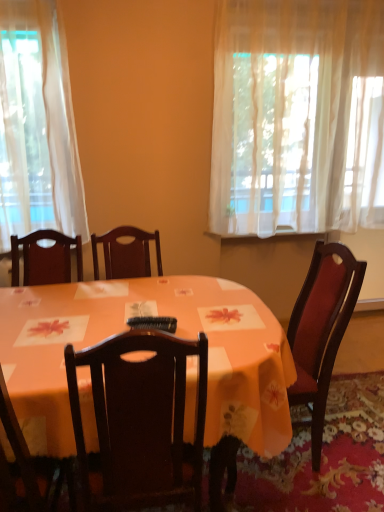
You are a GUI agent. You are given a task and a screenshot of the screen. Output one action in this format:
    pyautogui.click(x=<x>, y=<y>)
    Task: Click on the wooden chair at lower left
    Image resolution: width=384 pixels, height=512 pixels.
    Given the screenshot: What is the action you would take?
    pyautogui.click(x=19, y=449)

Image resolution: width=384 pixels, height=512 pixels. What do you see at coordinates (297, 117) in the screenshot?
I see `sheer white curtain at upper right` at bounding box center [297, 117].

This screenshot has height=512, width=384. I want to click on black plastic remote control at center, so click(153, 323).

The image size is (384, 512). I want to click on orange fabric table at center, so click(127, 329).

Which object is closer to the camera, orange fabric table at center or sheer white curtain at upper right?

orange fabric table at center.

Considering the sizes of objects orange fabric table at center and sheer white curtain at upper right in the image provided, who is taller, orange fabric table at center or sheer white curtain at upper right?

sheer white curtain at upper right.

From the image's perspective, between orange fabric table at center and sheer white curtain at upper right, which one is located above?

sheer white curtain at upper right appears higher in the image.

In the scene shown: Is orange fabric table at center located outside sheer white curtain at upper right?

orange fabric table at center lies outside sheer white curtain at upper right's area.

From the image's perspective, is sheer white curtain at upper right positioned above or below wooden chair at lower left?

Clearly, from the image's perspective, sheer white curtain at upper right is above wooden chair at lower left.

Is sheer white curtain at upper right to the left or to the right of wooden chair at lower left in the image?

sheer white curtain at upper right is to the right of wooden chair at lower left.

Considering the sizes of objects sheer white curtain at upper right and wooden chair at lower left in the image provided, who is taller, sheer white curtain at upper right or wooden chair at lower left?

sheer white curtain at upper right is taller.

Which point is more distant from viewer, (255, 8) or (7, 470)?

Positioned behind is point (255, 8).

Looking at this image, would you say wooden chair at lower left is to the left or to the right of sheer white curtain at upper right in the picture?

wooden chair at lower left is to the left of sheer white curtain at upper right.

Is wooden chair at lower left taller or shorter than sheer white curtain at upper right?

Clearly, wooden chair at lower left is shorter compared to sheer white curtain at upper right.

Which of these two, wooden chair at lower left or sheer white curtain at upper right, is thinner?

sheer white curtain at upper right is thinner.

Is black plastic remote control at center positioned behind wooden chair at lower left?

Yes, the depth of black plastic remote control at center is greater than that of wooden chair at lower left.

Considering the relative positions of black plastic remote control at center and wooden chair at lower left in the image provided, is black plastic remote control at center to the left of wooden chair at lower left from the viewer's perspective?

Incorrect, black plastic remote control at center is not on the left side of wooden chair at lower left.

Does black plastic remote control at center have a lesser height compared to wooden chair at lower left?

Yes.

Looking at this image, from the image's perspective, is sheer white curtain at upper right above or below orange fabric table at center?

Based on their image positions, sheer white curtain at upper right is located above orange fabric table at center.

How different are the orientations of sheer white curtain at upper right and orange fabric table at center in degrees?

sheer white curtain at upper right and orange fabric table at center are facing 0.212 degrees away from each other.

Identify the location of curtain above the orange fabric table at center (from a real-world perspective). (297, 117).

Considering the sizes of objects orange fabric table at center and wooden chair at lower left in the image provided, who is bigger, orange fabric table at center or wooden chair at lower left?

orange fabric table at center is bigger.

Looking at this image, from a real-world perspective, is orange fabric table at center above or below wooden chair at lower left?

Clearly, from a real-world perspective, orange fabric table at center is below wooden chair at lower left.

Considering the relative sizes of orange fabric table at center and wooden chair at lower left in the image provided, is orange fabric table at center taller than wooden chair at lower left?

No, orange fabric table at center is not taller than wooden chair at lower left.

Which object is positioned more to the right, orange fabric table at center or wooden chair at lower left?

Positioned to the right is orange fabric table at center.

Can black plastic remote control at center be found inside wooden chair at lower left?

No, wooden chair at lower left does not contain black plastic remote control at center.

Between wooden chair at lower left and black plastic remote control at center, which one appears on the left side from the viewer's perspective?

wooden chair at lower left is more to the left.

Is wooden chair at lower left oriented away from black plastic remote control at center?

No, wooden chair at lower left's orientation is not away from black plastic remote control at center.

Locate an element on the screen. Image resolution: width=384 pixels, height=512 pixels. desk below the sheer white curtain at upper right (from a real-world perspective) is located at coordinates (127, 329).

You are a GUI agent. You are given a task and a screenshot of the screen. Output one action in this format:
    pyautogui.click(x=<x>, y=<y>)
    Task: Click on the chair in front of the sheer white curtain at upper right
    The image size is (384, 512).
    Given the screenshot: What is the action you would take?
    pyautogui.click(x=19, y=449)

Considering their positions, is orange fabric table at center positioned closer to black plastic remote control at center than wooden chair at lower left?

wooden chair at lower left is positioned closer to the anchor black plastic remote control at center.

Based on their spatial positions, is wooden chair at lower left or orange fabric table at center closer to black plastic remote control at center?

Based on the image, wooden chair at lower left appears to be nearer to black plastic remote control at center.

Which object lies nearer to the anchor point orange fabric table at center, wooden chair at lower left or black plastic remote control at center?

wooden chair at lower left is closer to orange fabric table at center.

From the image, which object appears to be farther from sheer white curtain at upper right, wooden chair at lower left or black plastic remote control at center?

wooden chair at lower left lies further to sheer white curtain at upper right than the other object.

Which object lies further to the anchor point black plastic remote control at center, orange fabric table at center or sheer white curtain at upper right?

The object further to black plastic remote control at center is sheer white curtain at upper right.

Looking at the image, which one is located closer to sheer white curtain at upper right, black plastic remote control at center or orange fabric table at center?

Among the two, orange fabric table at center is located nearer to sheer white curtain at upper right.

From the image, which object appears to be farther from orange fabric table at center, wooden chair at lower left or sheer white curtain at upper right?

The object further to orange fabric table at center is sheer white curtain at upper right.

Considering their positions, is black plastic remote control at center positioned closer to sheer white curtain at upper right than wooden chair at lower left?

black plastic remote control at center lies closer to sheer white curtain at upper right than the other object.

Where is `desk that lies between sheer white curtain at upper right and wooden chair at lower left from top to bottom`? desk that lies between sheer white curtain at upper right and wooden chair at lower left from top to bottom is located at coordinates (127, 329).

Locate an element on the screen. The width and height of the screenshot is (384, 512). remote control between sheer white curtain at upper right and orange fabric table at center vertically is located at coordinates (153, 323).

I want to click on remote control between sheer white curtain at upper right and wooden chair at lower left in the vertical direction, so click(153, 323).

The image size is (384, 512). What are the coordinates of `desk located between wooden chair at lower left and black plastic remote control at center in the depth direction` in the screenshot? It's located at (127, 329).